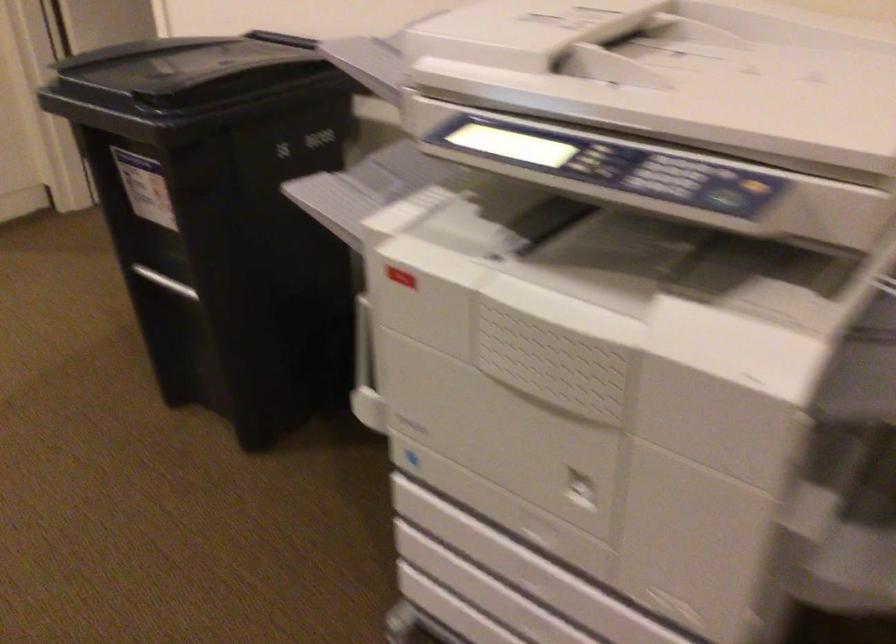
This screenshot has height=644, width=896. I want to click on printer panel handle, so [x=666, y=176].